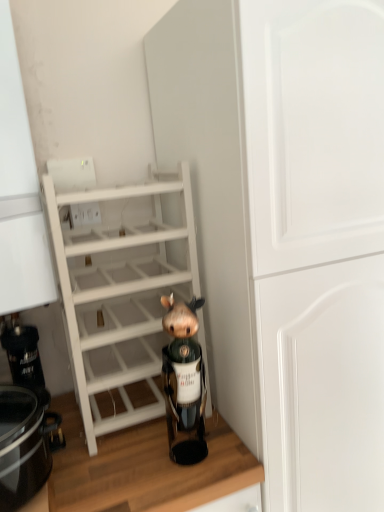
Locate an element on the screen. vacant space to the right of brown matte figurine at center is located at coordinates (231, 453).